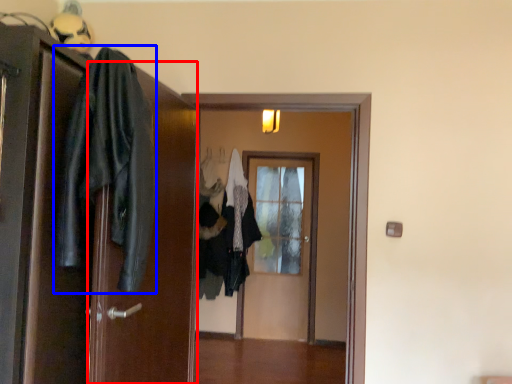
Question: Among these objects, which one is farthest to the camera, screen door (highlighted by a red box) or clothing (highlighted by a blue box)?

Choices:
 (A) screen door
 (B) clothing

Answer: (A)